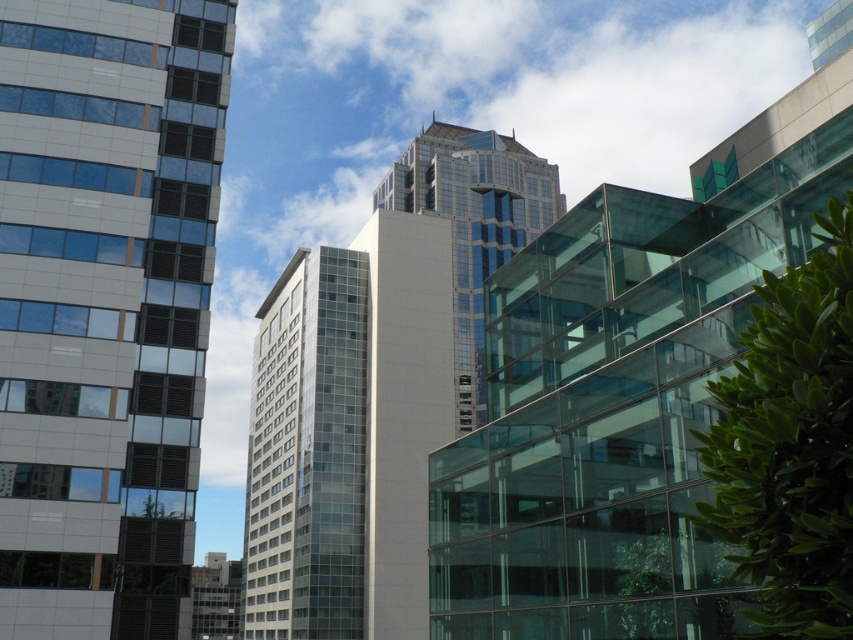
Which of these two, white glass building at left or glassy reflective skyscraper at center, stands shorter?

white glass building at left is shorter.

Does point (112, 145) lie in front of point (399, 189)?

Yes, it is.

The width and height of the screenshot is (853, 640). I want to click on white glass building at left, so click(x=103, y=305).

Can you confirm if white glass building at center is thinner than glassy reflective skyscraper at center?

Indeed, white glass building at center has a lesser width compared to glassy reflective skyscraper at center.

Is white glass building at center in front of glassy reflective skyscraper at center?

No.

You are a GUI agent. You are given a task and a screenshot of the screen. Output one action in this format:
    pyautogui.click(x=<x>, y=<y>)
    Task: Click on the white glass building at center
    The width and height of the screenshot is (853, 640).
    Given the screenshot: What is the action you would take?
    pyautogui.click(x=347, y=433)

Which is behind, point (45, 109) or point (277, 362)?

Positioned behind is point (277, 362).

Can you confirm if white glass building at left is smaller than white glass building at center?

→ Indeed, white glass building at left has a smaller size compared to white glass building at center.

Is point (131, 301) positioned behind point (288, 513)?

That is False.

You are a GUI agent. You are given a task and a screenshot of the screen. Output one action in this format:
    pyautogui.click(x=<x>, y=<y>)
    Task: Click on the white glass building at left
    This screenshot has width=853, height=640.
    Given the screenshot: What is the action you would take?
    pyautogui.click(x=103, y=305)